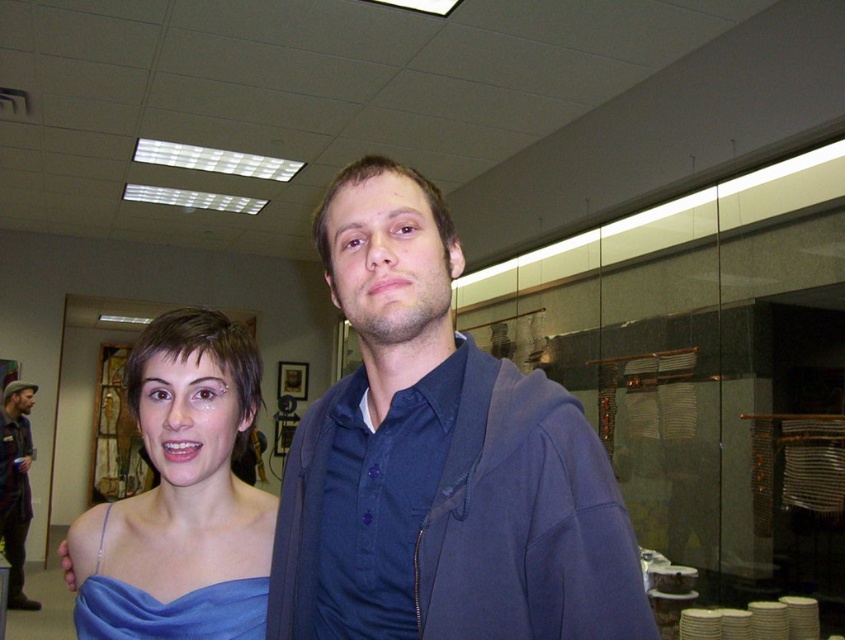
Is satin blue dress at center further to the viewer compared to blue satin dress at center?

Yes, satin blue dress at center is behind blue satin dress at center.

In the scene shown: Does satin blue dress at center appear on the left side of blue satin dress at center?

Incorrect, satin blue dress at center is not on the left side of blue satin dress at center.

Is point (197, 410) positioned before point (217, 608)?

No, (197, 410) is behind (217, 608).

Identify the location of satin blue dress at center. The width and height of the screenshot is (845, 640). (181, 497).

Between point (187, 579) and point (18, 387), which one is positioned in front?

Positioned in front is point (187, 579).

Who is shorter, satin blue dress at center or brown leather jacket at left?

Standing shorter between the two is satin blue dress at center.

Between point (146, 419) and point (28, 419), which one is positioned in front?

Positioned in front is point (146, 419).

The height and width of the screenshot is (640, 845). What are the coordinates of `satin blue dress at center` in the screenshot? It's located at (181, 497).

Between point (399, 584) and point (135, 630), which one is positioned behind?

The point (135, 630) is more distant.

Looking at this image, how far apart are blue satin dress at left and satin blue dress at center?

blue satin dress at left and satin blue dress at center are 9.78 inches apart.

Consider the image. Measure the distance between blue satin dress at left and camera.

blue satin dress at left is 26.03 inches from camera.

Locate an element on the screen. The width and height of the screenshot is (845, 640). blue satin dress at left is located at coordinates (439, 460).